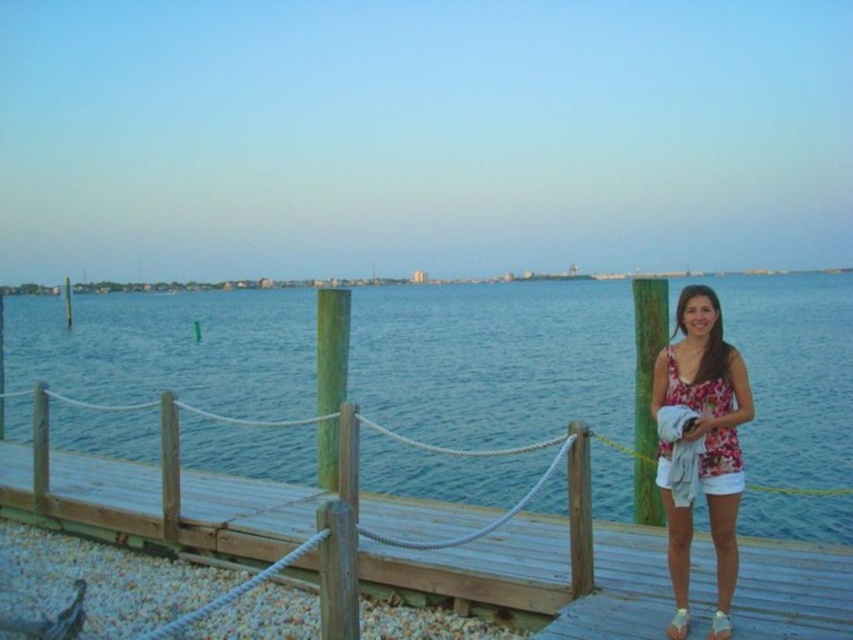
Question: Which point appears closest to the camera in this image?

Choices:
 (A) (680, 388)
 (B) (598, 458)

Answer: (A)

Question: Among these points, which one is farthest from the camera?

Choices:
 (A) (422, 573)
 (B) (668, 499)

Answer: (A)

Question: Which of the following is the closest to the observer?

Choices:
 (A) blue water at center
 (B) wooden dock at center
 (C) floral fabric top at center

Answer: (C)

Question: From the image, what is the correct spatial relationship of blue water at center in relation to wooden dock at center?

Choices:
 (A) above
 (B) below

Answer: (A)

Question: Can you confirm if wooden dock at center is thinner than floral fabric top at center?

Choices:
 (A) yes
 (B) no

Answer: (B)

Question: Does blue water at center have a lesser width compared to wooden dock at center?

Choices:
 (A) yes
 (B) no

Answer: (B)